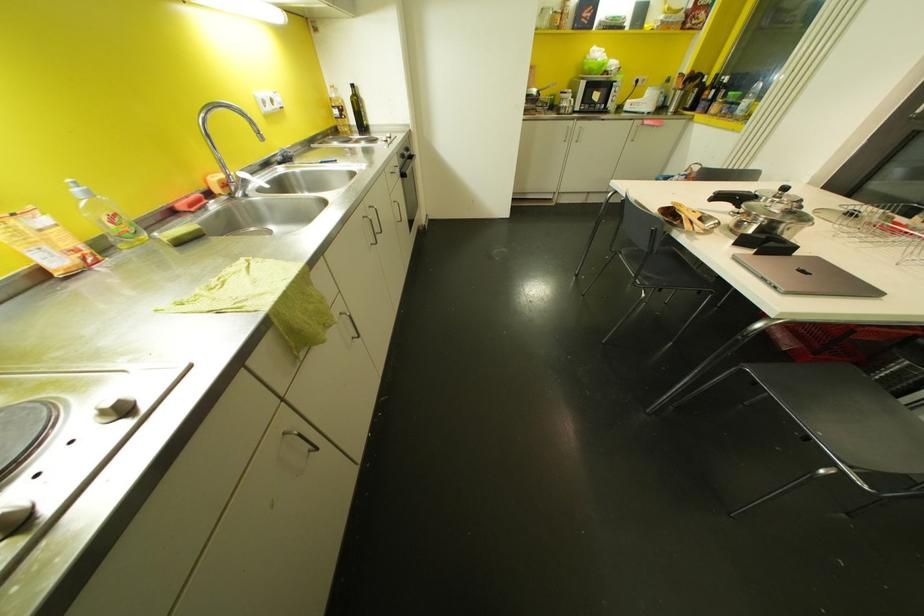
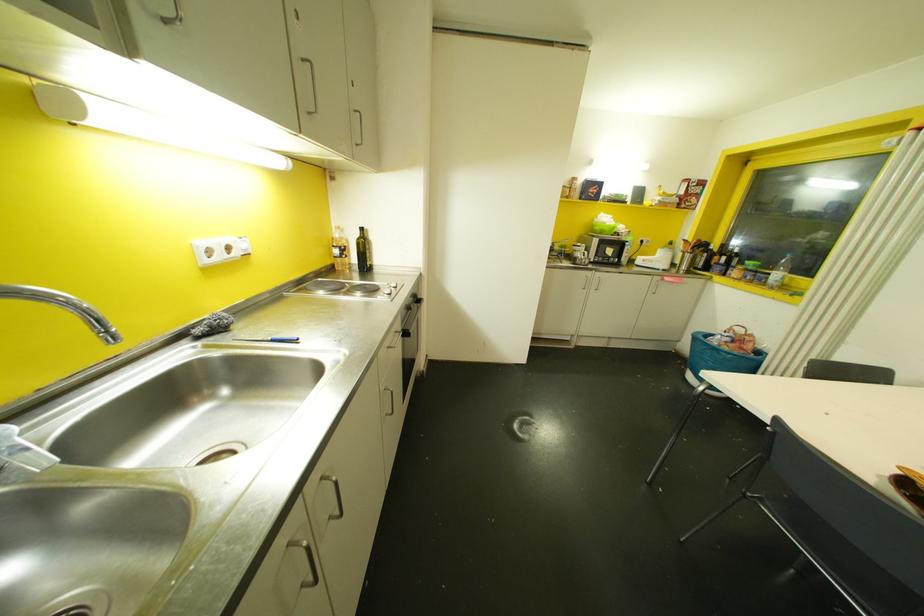
Find the pixel in the second image that matches (x=574, y=138) in the first image.

(592, 286)